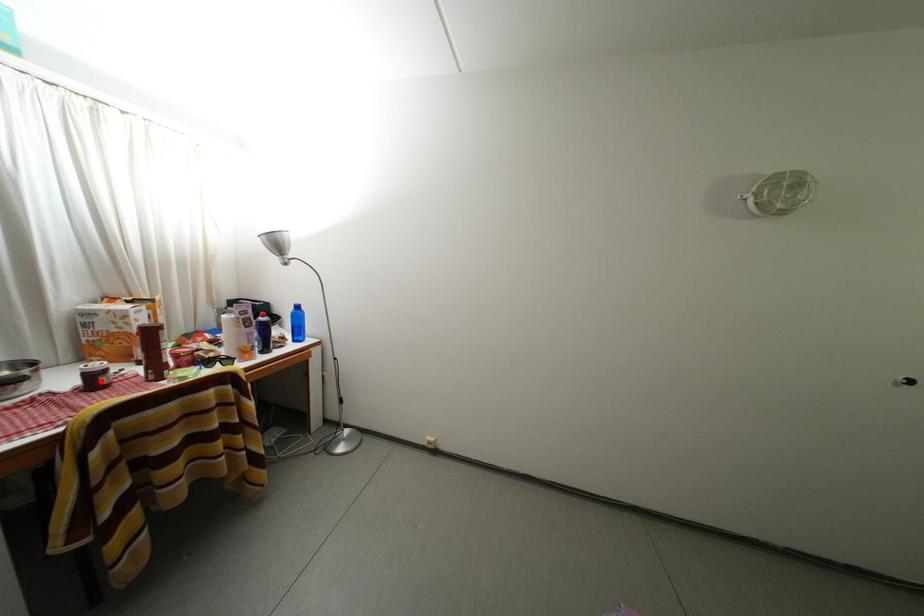
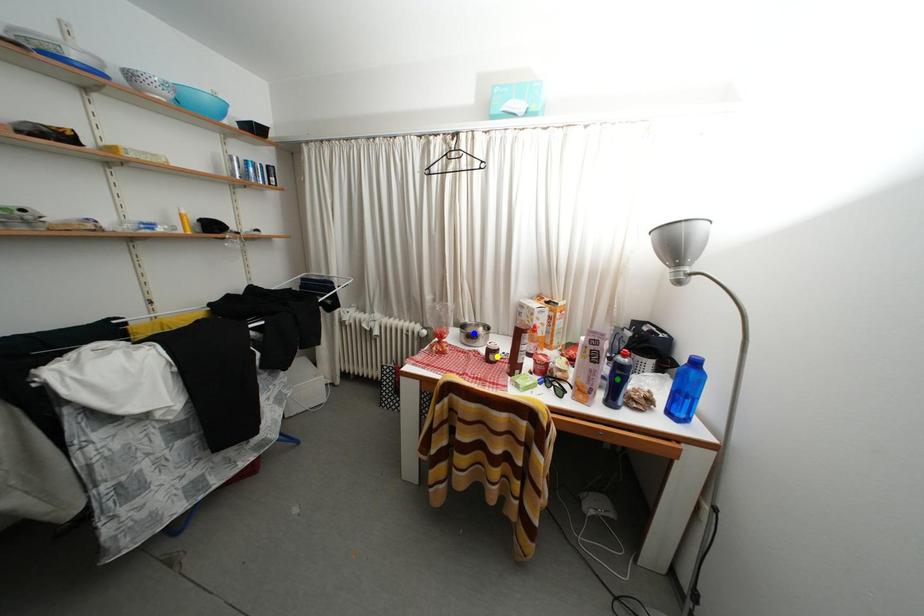
Question: I am providing you with two images of the same scene from different viewpoints. A red point is marked on the first image. You are given multiple points on the second image. Can you choose the point in image 2 that corresponds to the point in image 1?

Choices:
 (A) green point
 (B) yellow point
 (C) blue point

Answer: (B)